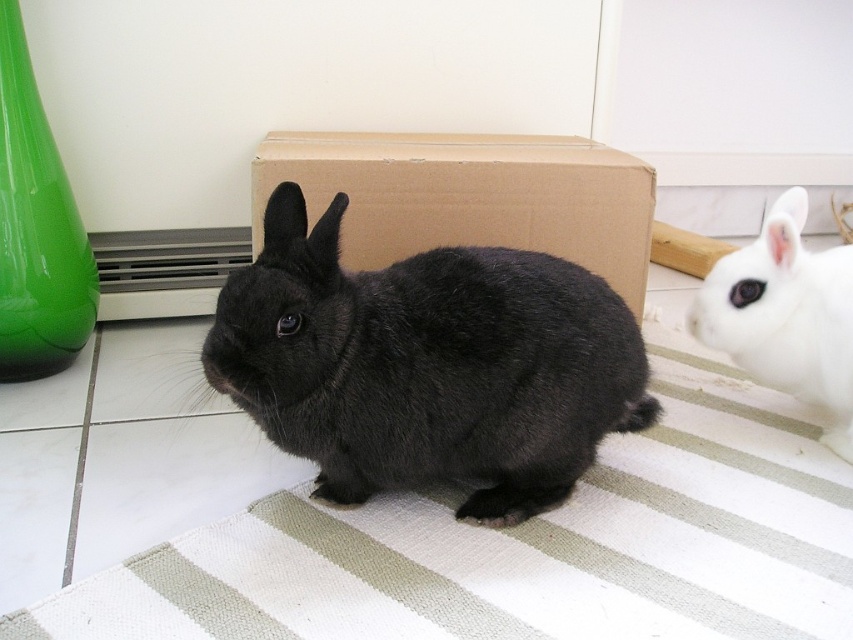
Does cardboard box at center have a smaller size compared to white fluffy rabbit at lower right?

Actually, cardboard box at center might be larger than white fluffy rabbit at lower right.

Is cardboard box at center to the left of white fluffy rabbit at lower right from the viewer's perspective?

Yes, cardboard box at center is to the left of white fluffy rabbit at lower right.

You are a GUI agent. You are given a task and a screenshot of the screen. Output one action in this format:
    pyautogui.click(x=<x>, y=<y>)
    Task: Click on the cardboard box at center
    The width and height of the screenshot is (853, 640).
    Given the screenshot: What is the action you would take?
    pyautogui.click(x=469, y=196)

Who is taller, black furry rabbit at center or cardboard box at center?

Standing taller between the two is black furry rabbit at center.

Locate an element on the screen. black furry rabbit at center is located at coordinates (427, 364).

Who is more distant from viewer, (485, 296) or (505, 145)?

The point (505, 145) is behind.

This screenshot has height=640, width=853. Identify the location of black furry rabbit at center. (427, 364).

Is black furry rabbit at center above white fluffy rabbit at lower right?

Incorrect, black furry rabbit at center is not positioned above white fluffy rabbit at lower right.

Does black furry rabbit at center appear under white fluffy rabbit at lower right?

Yes.

Is point (585, 333) positioned after point (846, 285)?

No.

Find the location of a particular element. The width and height of the screenshot is (853, 640). black furry rabbit at center is located at coordinates (427, 364).